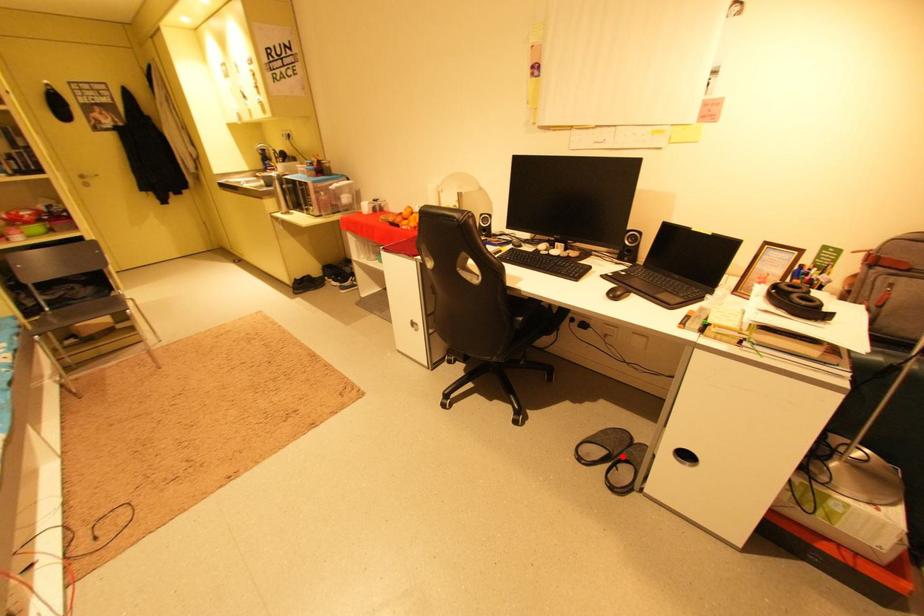
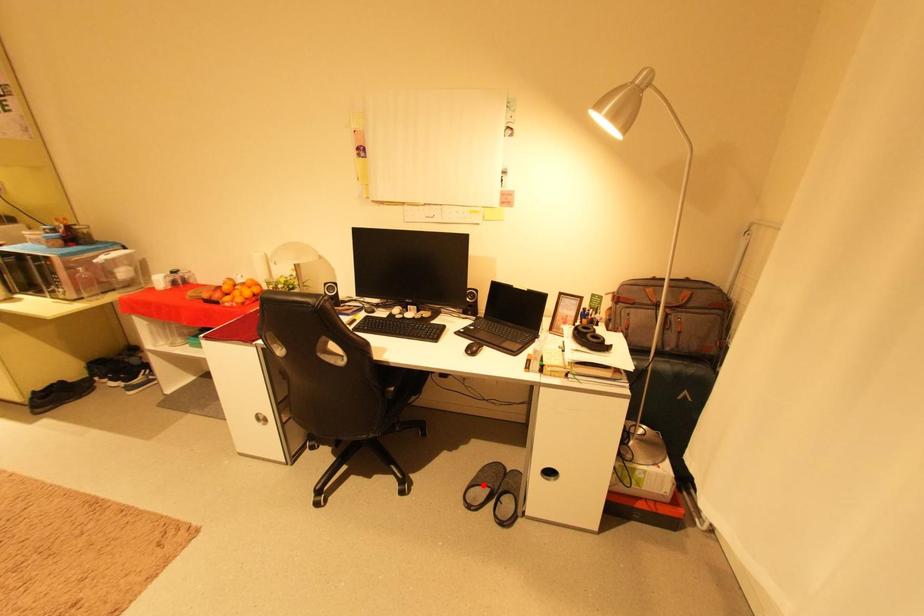
I am providing you with two images of the same scene from different viewpoints. A red point is marked on the first image and another point is marked on the second image. Does the point marked in image1 correspond to the same location as the one in image2?

No